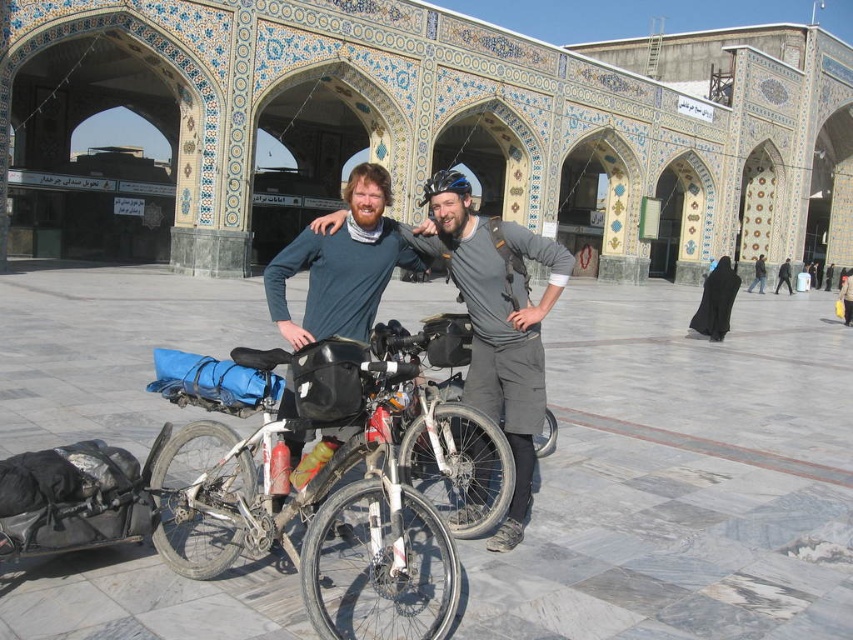
Can you confirm if white matte bicycle at center is taller than matte gray shirt at center?

Incorrect, white matte bicycle at center's height is not larger of matte gray shirt at center's.

Is white matte bicycle at center closer to camera compared to matte gray shirt at center?

That is True.

Is point (346, 445) more distant than point (469, 205)?

That is False.

The image size is (853, 640). In order to click on white matte bicycle at center in this screenshot , I will do `click(335, 492)`.

Does white matte bicycle at center have a greater width compared to black fabric headscarf at center?

Incorrect, white matte bicycle at center's width does not surpass black fabric headscarf at center's.

Between white matte bicycle at center and black fabric headscarf at center, which one has more height?

Standing taller between the two is black fabric headscarf at center.

The image size is (853, 640). I want to click on white matte bicycle at center, so click(x=335, y=492).

Who is more forward, [479,248] or [733,269]?

Point [479,248]

Does point (486, 314) come farther from viewer compared to point (701, 326)?

No, it is not.

At what (x,y) coordinates should I click in order to perform the action: click on matte gray shirt at center. Please return your answer as a coordinate pair (x, y). The width and height of the screenshot is (853, 640). Looking at the image, I should click on (496, 321).